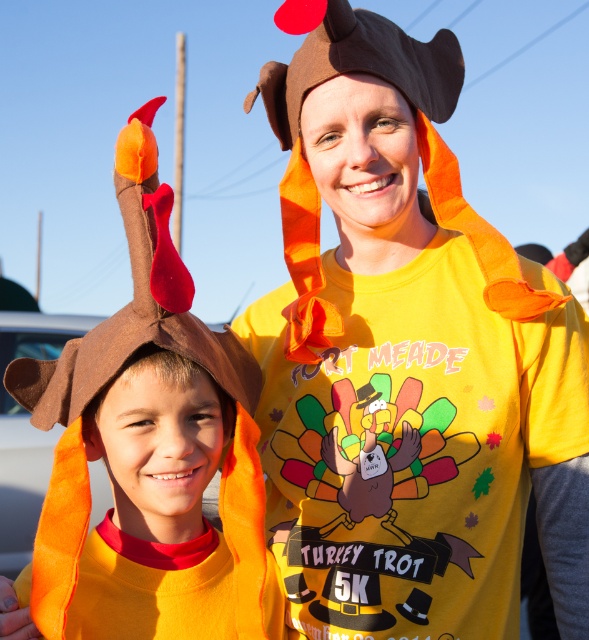
Question: Can you confirm if matte brown turkey hat at center is wider than felt turkey hat at left?

Choices:
 (A) yes
 (B) no

Answer: (A)

Question: Does matte brown turkey hat at center lie in front of felt turkey hat at left?

Choices:
 (A) yes
 (B) no

Answer: (B)

Question: Which object is farther from the camera taking this photo?

Choices:
 (A) felt turkey hat at left
 (B) matte brown turkey hat at center

Answer: (B)

Question: Is matte brown turkey hat at center further to camera compared to felt turkey hat at left?

Choices:
 (A) no
 (B) yes

Answer: (B)

Question: Among these objects, which one is nearest to the camera?

Choices:
 (A) matte brown turkey hat at center
 (B) felt turkey hat at left

Answer: (B)